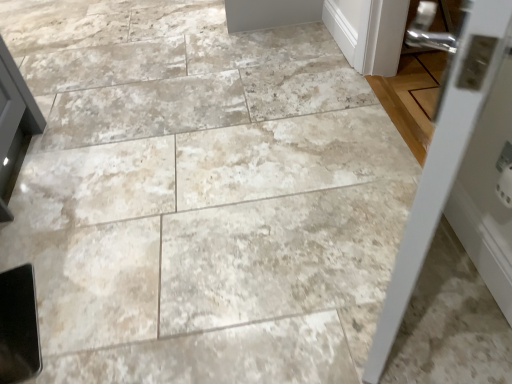
Question: Does point (471, 238) appear closer or farther from the camera than point (361, 34)?

Choices:
 (A) closer
 (B) farther

Answer: (A)

Question: Relative to white painted wood door at upper right, which is the second door from front to back, is white glossy door at right, the 2th door in the back-to-front sequence, in front or behind?

Choices:
 (A) behind
 (B) front

Answer: (B)

Question: Is white glossy door at right, acting as the first door starting from the bottom, bigger or smaller than white painted wood door at upper right, which is the second door from front to back?

Choices:
 (A) small
 (B) big

Answer: (B)

Question: Would you say white painted wood door at upper right, which is the second door from front to back, is inside or outside white glossy door at right, the 2th door in the back-to-front sequence?

Choices:
 (A) outside
 (B) inside

Answer: (A)

Question: From a real-world perspective, is white painted wood door at upper right, positioned as the 1th door in back-to-front order, positioned above or below white glossy door at right, the first door from the front?

Choices:
 (A) below
 (B) above

Answer: (A)

Question: Visually, is white painted wood door at upper right, which is the second door from front to back, positioned to the left or to the right of white glossy door at right, the 2th door in the back-to-front sequence?

Choices:
 (A) right
 (B) left

Answer: (A)

Question: Considering the positions of white painted wood door at upper right, which is counted as the 2th door, starting from the bottom, and white glossy door at right, which is the second door from top to bottom, in the image, is white painted wood door at upper right, which is counted as the 2th door, starting from the bottom, taller or shorter than white glossy door at right, which is the second door from top to bottom,?

Choices:
 (A) short
 (B) tall

Answer: (A)